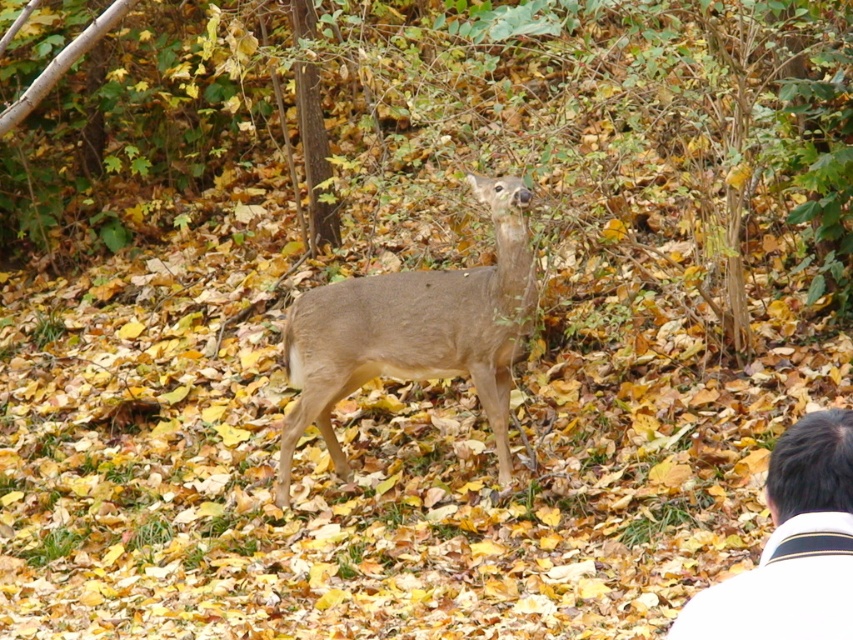
Question: Is light brown fur at center bigger than white shirt at lower right?

Choices:
 (A) no
 (B) yes

Answer: (B)

Question: Which object appears closest to the camera in this image?

Choices:
 (A) white shirt at lower right
 (B) light brown fur at center

Answer: (A)

Question: Can you confirm if light brown fur at center is wider than white shirt at lower right?

Choices:
 (A) no
 (B) yes

Answer: (B)

Question: Which of the following is the farthest from the observer?

Choices:
 (A) (767, 572)
 (B) (379, 353)

Answer: (B)

Question: Is light brown fur at center bigger than white shirt at lower right?

Choices:
 (A) yes
 (B) no

Answer: (A)